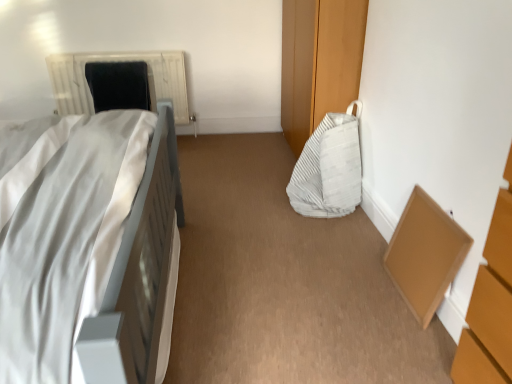
Question: Considering the relative sizes of black fabric bean bag at upper left, the second bean bag chair viewed from the right, and white textured radiator at upper left in the image provided, is black fabric bean bag at upper left, the second bean bag chair viewed from the right, bigger than white textured radiator at upper left?

Choices:
 (A) yes
 (B) no

Answer: (B)

Question: Does black fabric bean bag at upper left, which ranks as the first bean bag chair in left-to-right order, turn towards white textured radiator at upper left?

Choices:
 (A) no
 (B) yes

Answer: (B)

Question: Considering the relative positions of black fabric bean bag at upper left, which ranks as the first bean bag chair in left-to-right order, and white textured radiator at upper left in the image provided, is black fabric bean bag at upper left, which ranks as the first bean bag chair in left-to-right order, to the right of white textured radiator at upper left from the viewer's perspective?

Choices:
 (A) no
 (B) yes

Answer: (B)

Question: Is black fabric bean bag at upper left, which is counted as the first bean bag chair, starting from the top, smaller than white textured radiator at upper left?

Choices:
 (A) yes
 (B) no

Answer: (A)

Question: From a real-world perspective, is white matte bed at left positioned above or below white textured radiator at upper left?

Choices:
 (A) above
 (B) below

Answer: (A)

Question: Based on their sizes in the image, would you say white matte bed at left is bigger or smaller than white textured radiator at upper left?

Choices:
 (A) small
 (B) big

Answer: (B)

Question: In terms of height, does white matte bed at left look taller or shorter compared to white textured radiator at upper left?

Choices:
 (A) short
 (B) tall

Answer: (B)

Question: In the image, is white matte bed at left positioned in front of or behind white textured radiator at upper left?

Choices:
 (A) front
 (B) behind

Answer: (A)

Question: Considering their positions, is brown cardboard box at lower right located in front of or behind white textured radiator at upper left?

Choices:
 (A) front
 (B) behind

Answer: (A)

Question: Is brown cardboard box at lower right bigger or smaller than white textured radiator at upper left?

Choices:
 (A) small
 (B) big

Answer: (A)

Question: From the image's perspective, relative to white textured radiator at upper left, is brown cardboard box at lower right above or below?

Choices:
 (A) above
 (B) below

Answer: (B)

Question: Is brown cardboard box at lower right inside or outside of white textured radiator at upper left?

Choices:
 (A) outside
 (B) inside

Answer: (A)

Question: From the image's perspective, is black fabric bean bag at upper left, which ranks as the first bean bag chair in left-to-right order, located above or below white matte bed at left?

Choices:
 (A) above
 (B) below

Answer: (A)

Question: Based on their sizes in the image, would you say black fabric bean bag at upper left, which is the second bean bag chair in bottom-to-top order, is bigger or smaller than white matte bed at left?

Choices:
 (A) big
 (B) small

Answer: (B)